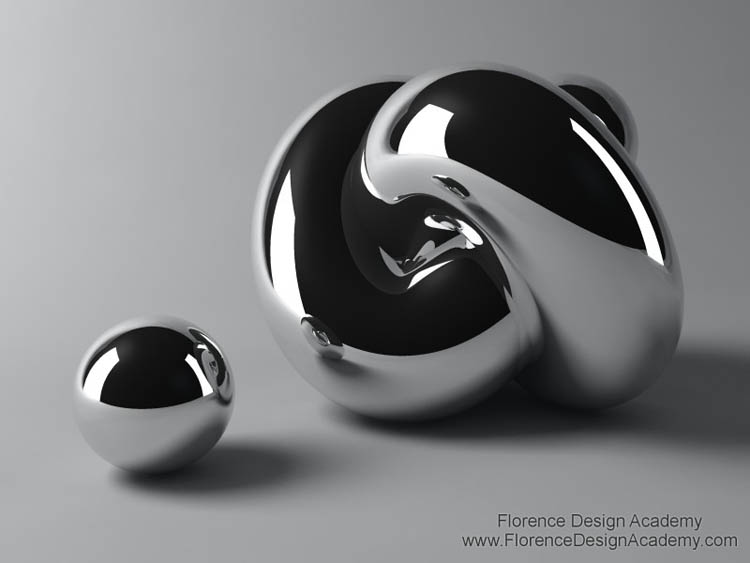
In order to click on reflection of artistic chrome ball in this screenshot , I will do `click(220, 361)`.